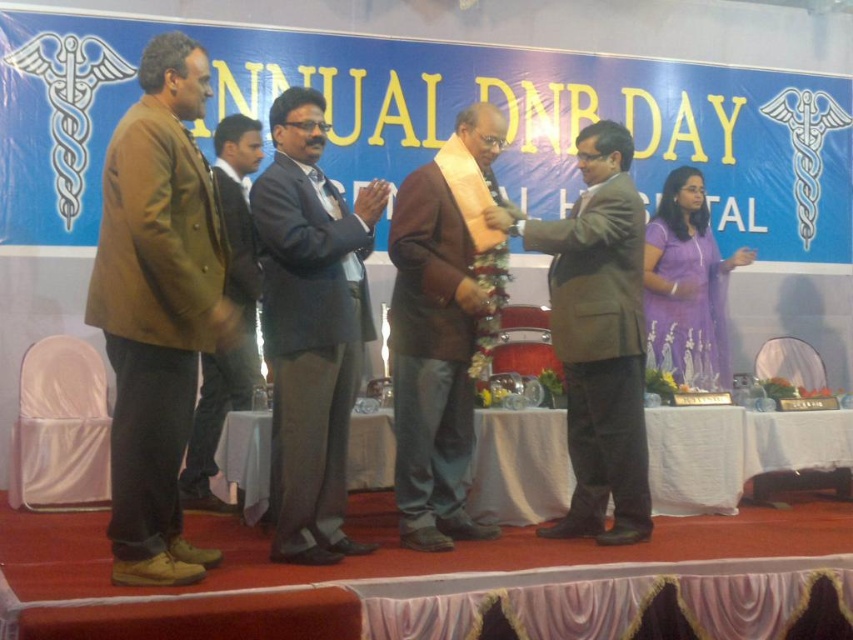
Can you confirm if brown leather jacket at left is positioned below brown matte jacket at center?

Actually, brown leather jacket at left is above brown matte jacket at center.

Who is higher up, brown leather jacket at left or brown matte jacket at center?

brown leather jacket at left

What do you see at coordinates (157, 308) in the screenshot?
I see `brown leather jacket at left` at bounding box center [157, 308].

You are a GUI agent. You are given a task and a screenshot of the screen. Output one action in this format:
    pyautogui.click(x=<x>, y=<y>)
    Task: Click on the brown leather jacket at left
    
    Given the screenshot: What is the action you would take?
    pyautogui.click(x=157, y=308)

Between matte brown suit at center and brown woolen jacket at left, which one has more height?

brown woolen jacket at left

Is point (543, 532) positioned before point (241, 403)?

That is True.

You are a GUI agent. You are given a task and a screenshot of the screen. Output one action in this format:
    pyautogui.click(x=<x>, y=<y>)
    Task: Click on the matte brown suit at center
    This screenshot has height=640, width=853.
    Given the screenshot: What is the action you would take?
    pyautogui.click(x=596, y=336)

Which is more to the right, dark gray suit at center or brown matte jacket at center?

brown matte jacket at center is more to the right.

Can you confirm if dark gray suit at center is positioned to the right of brown matte jacket at center?

In fact, dark gray suit at center is to the left of brown matte jacket at center.

Between point (302, 513) and point (405, 445), which one is positioned behind?

Positioned behind is point (405, 445).

This screenshot has width=853, height=640. In order to click on dark gray suit at center in this screenshot , I will do `click(311, 326)`.